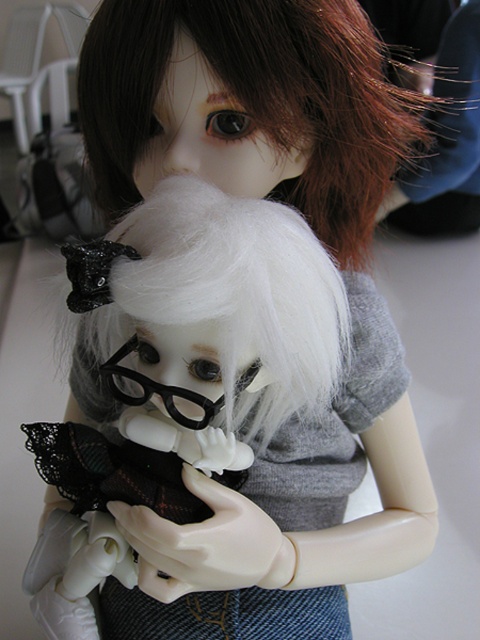
Question: Can you confirm if dark brown silky hair at upper center is positioned to the right of matte gray hair at upper center?

Choices:
 (A) no
 (B) yes

Answer: (A)

Question: Can you confirm if dark brown silky hair at upper center is positioned to the left of matte gray hair at upper center?

Choices:
 (A) no
 (B) yes

Answer: (B)

Question: Which object appears closest to the camera in this image?

Choices:
 (A) dark brown silky hair at upper center
 (B) matte gray hair at upper center

Answer: (A)

Question: Does dark brown silky hair at upper center come in front of matte gray hair at upper center?

Choices:
 (A) yes
 (B) no

Answer: (A)

Question: Which of the following is the closest to the observer?

Choices:
 (A) (445, 152)
 (B) (339, 38)

Answer: (B)